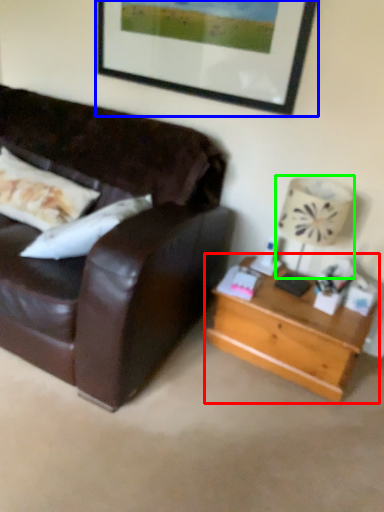
Question: Which is farther away from table (highlighted by a red box)? picture frame (highlighted by a blue box) or lamp (highlighted by a green box)?

Choices:
 (A) picture frame
 (B) lamp

Answer: (A)